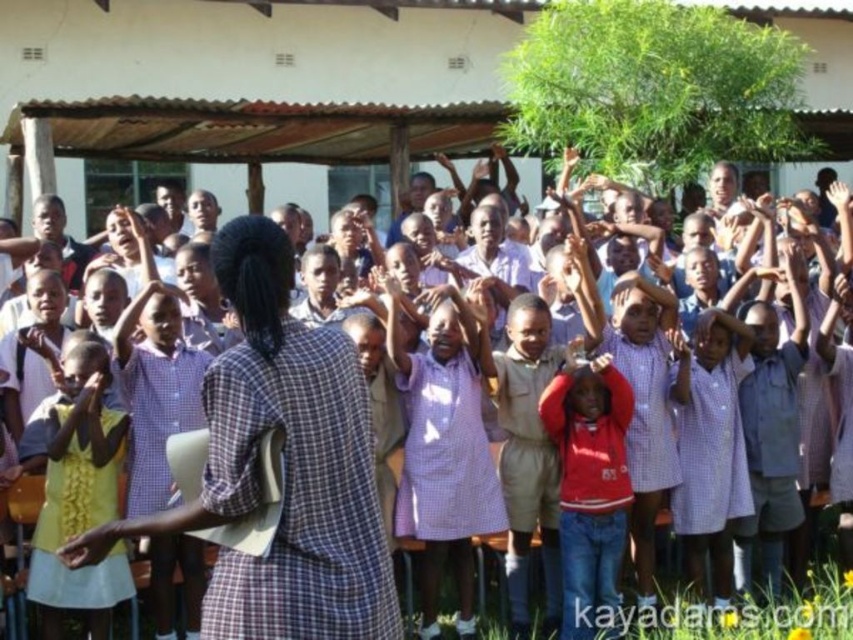
Measure the distance between smooth skin hand at lower left and camera.

The distance of smooth skin hand at lower left from camera is 100.77 feet.

Which is more to the right, smooth skin hand at lower left or yellow fabric hand at lower left?

smooth skin hand at lower left

Locate an element on the screen. smooth skin hand at lower left is located at coordinates (90, 545).

You are a GUI agent. You are given a task and a screenshot of the screen. Output one action in this format:
    pyautogui.click(x=<x>, y=<y>)
    Task: Click on the smooth skin hand at lower left
    The height and width of the screenshot is (640, 853).
    Given the screenshot: What is the action you would take?
    pyautogui.click(x=90, y=545)

Does yellow fabric dress at lower left have a lesser width compared to red fleece jacket at center?

In fact, yellow fabric dress at lower left might be wider than red fleece jacket at center.

Is yellow fabric dress at lower left further to camera compared to red fleece jacket at center?

No, it is in front of red fleece jacket at center.

Where is `yellow fabric dress at lower left`? Image resolution: width=853 pixels, height=640 pixels. yellow fabric dress at lower left is located at coordinates (79, 502).

Image resolution: width=853 pixels, height=640 pixels. What are the coordinates of `yellow fabric dress at lower left` in the screenshot? It's located at (79, 502).

Can you confirm if red fleece jacket at center is shorter than yellow fabric hand at lower left?

Yes.

Can you confirm if red fleece jacket at center is bigger than yellow fabric hand at lower left?

No, red fleece jacket at center is not bigger than yellow fabric hand at lower left.

Which is behind, point (595, 413) or point (99, 401)?

Point (595, 413)

Where is `red fleece jacket at center`? The image size is (853, 640). red fleece jacket at center is located at coordinates (589, 484).